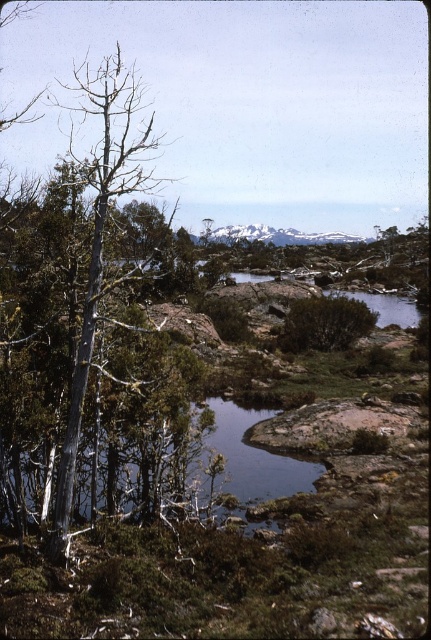
Which is in front, point (109, 92) or point (218, 240)?

Positioned in front is point (109, 92).

Is silver bark tree at left shorter than snowy rock at center?

In fact, silver bark tree at left may be taller than snowy rock at center.

Who is more distant from viewer, (x=93, y=182) or (x=275, y=230)?

The point (x=275, y=230) is more distant.

Locate an element on the screen. This screenshot has height=640, width=431. silver bark tree at left is located at coordinates (102, 237).

Is the position of silver bark tree at left more distant than that of green leafy bush at center?

No, silver bark tree at left is in front of green leafy bush at center.

Does silver bark tree at left have a lesser height compared to green leafy bush at center?

No.

Image resolution: width=431 pixels, height=640 pixels. I want to click on silver bark tree at left, so click(102, 237).

The width and height of the screenshot is (431, 640). I want to click on silver bark tree at left, so click(x=102, y=237).

Does green leafy bush at center have a smaller size compared to snowy rock at center?

Indeed, green leafy bush at center has a smaller size compared to snowy rock at center.

Image resolution: width=431 pixels, height=640 pixels. I want to click on green leafy bush at center, so click(324, 323).

Locate an element on the screen. green leafy bush at center is located at coordinates (324, 323).